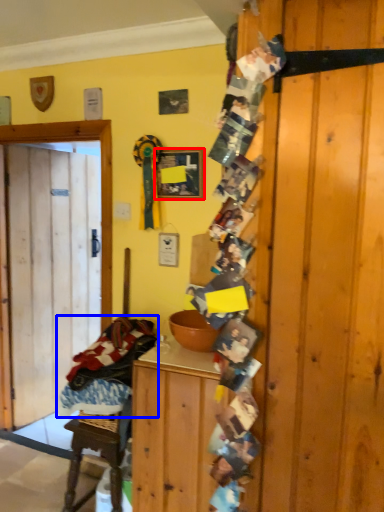
Question: Which of the following is the closest to the observer, picture frame (highlighted by a red box) or laundry (highlighted by a blue box)?

Choices:
 (A) picture frame
 (B) laundry

Answer: (B)